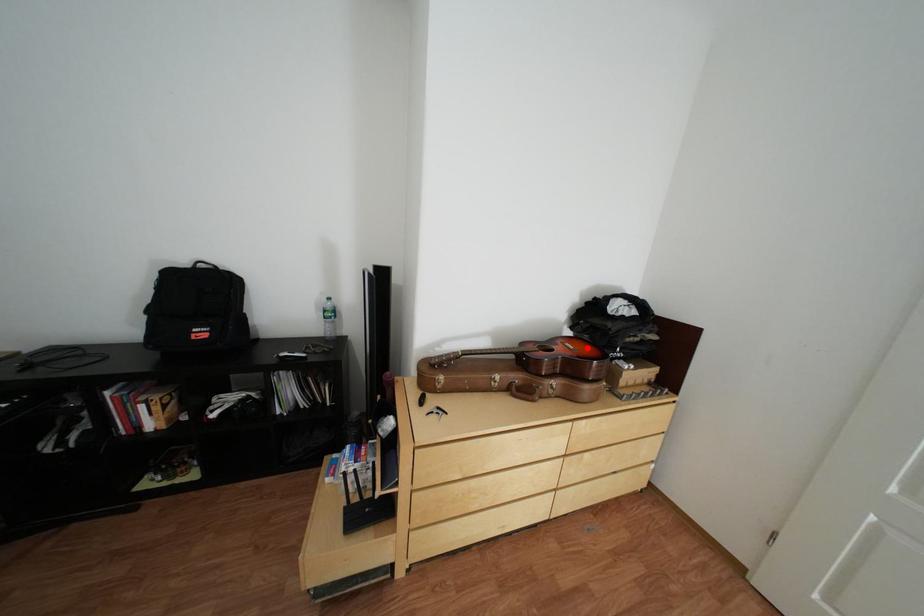
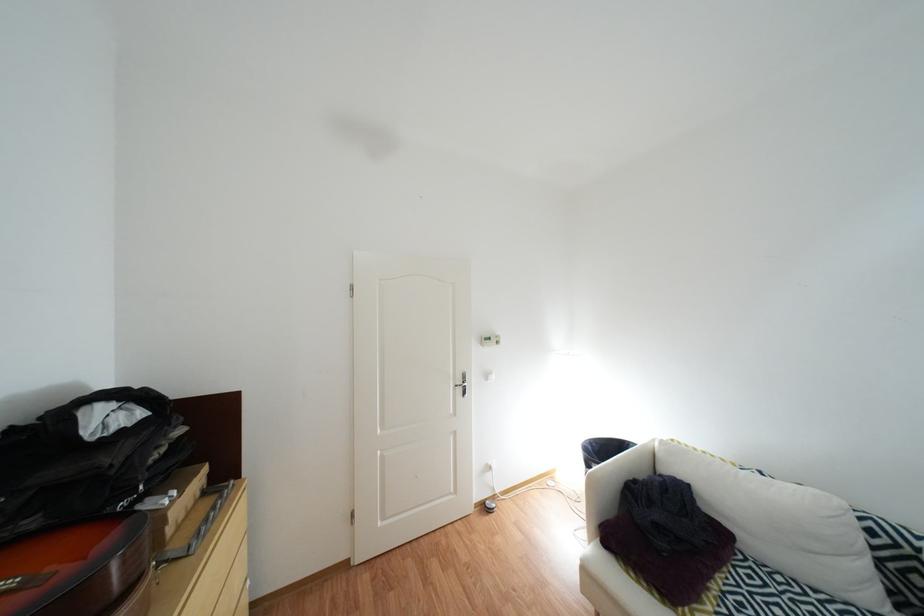
Question: I am providing you with two images of the same scene from different viewpoints. A red point is marked on the first image. At the location where the point appears in image 1, is it still visible in image 2?

Choices:
 (A) Yes
 (B) No

Answer: (A)